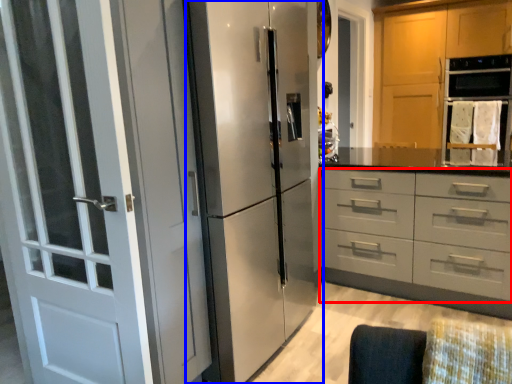
Question: Which object appears farthest to the camera in this image, drawer (highlighted by a red box) or refrigerator (highlighted by a blue box)?

Choices:
 (A) drawer
 (B) refrigerator

Answer: (A)